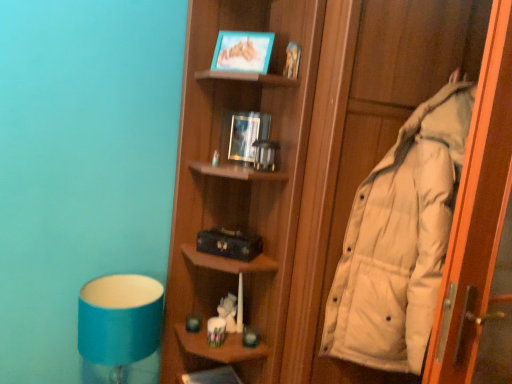
Question: Is white down jacket at right facing away from blue fabric lampshade at lower left?

Choices:
 (A) yes
 (B) no

Answer: (B)

Question: Does white down jacket at right have a lesser height compared to blue fabric lampshade at lower left?

Choices:
 (A) yes
 (B) no

Answer: (B)

Question: Is the position of white down jacket at right less distant than that of blue fabric lampshade at lower left?

Choices:
 (A) no
 (B) yes

Answer: (B)

Question: Is white down jacket at right in contact with blue fabric lampshade at lower left?

Choices:
 (A) no
 (B) yes

Answer: (A)

Question: From a real-world perspective, is white down jacket at right under blue fabric lampshade at lower left?

Choices:
 (A) yes
 (B) no

Answer: (B)

Question: Considering the positions of blue fabric lampshade at lower left and wooden shelf at lower center in the image, is blue fabric lampshade at lower left wider or thinner than wooden shelf at lower center?

Choices:
 (A) wide
 (B) thin

Answer: (A)

Question: Is blue fabric lampshade at lower left situated inside wooden shelf at lower center or outside?

Choices:
 (A) outside
 (B) inside

Answer: (A)

Question: Considering the positions of blue fabric lampshade at lower left and wooden shelf at lower center in the image, is blue fabric lampshade at lower left taller or shorter than wooden shelf at lower center?

Choices:
 (A) short
 (B) tall

Answer: (B)

Question: From the image's perspective, is blue fabric lampshade at lower left positioned above or below wooden shelf at lower center?

Choices:
 (A) below
 (B) above

Answer: (B)

Question: Is white down jacket at right wider or thinner than blue fabric lampshade at lower left?

Choices:
 (A) wide
 (B) thin

Answer: (A)

Question: In the image, is white down jacket at right on the left side or the right side of blue fabric lampshade at lower left?

Choices:
 (A) left
 (B) right

Answer: (B)

Question: Does point (414, 284) appear closer or farther from the camera than point (147, 314)?

Choices:
 (A) closer
 (B) farther

Answer: (A)

Question: From the image's perspective, is white down jacket at right above or below blue fabric lampshade at lower left?

Choices:
 (A) above
 (B) below

Answer: (A)

Question: Is white down jacket at right bigger or smaller than wooden shelf at lower center?

Choices:
 (A) big
 (B) small

Answer: (A)

Question: Is point (490, 142) closer or farther from the camera than point (202, 372)?

Choices:
 (A) closer
 (B) farther

Answer: (A)